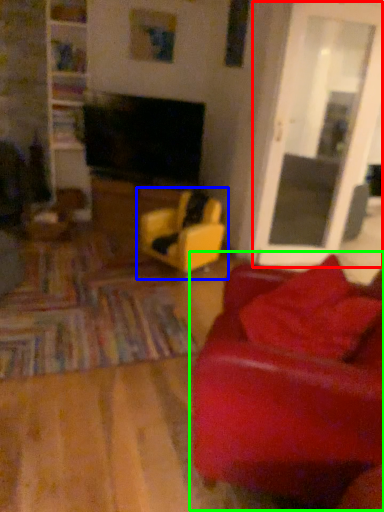
Question: Which object is the farthest from glass door (highlighted by a red box)? Choose among these: chair (highlighted by a blue box) or studio couch (highlighted by a green box).

Choices:
 (A) chair
 (B) studio couch

Answer: (B)